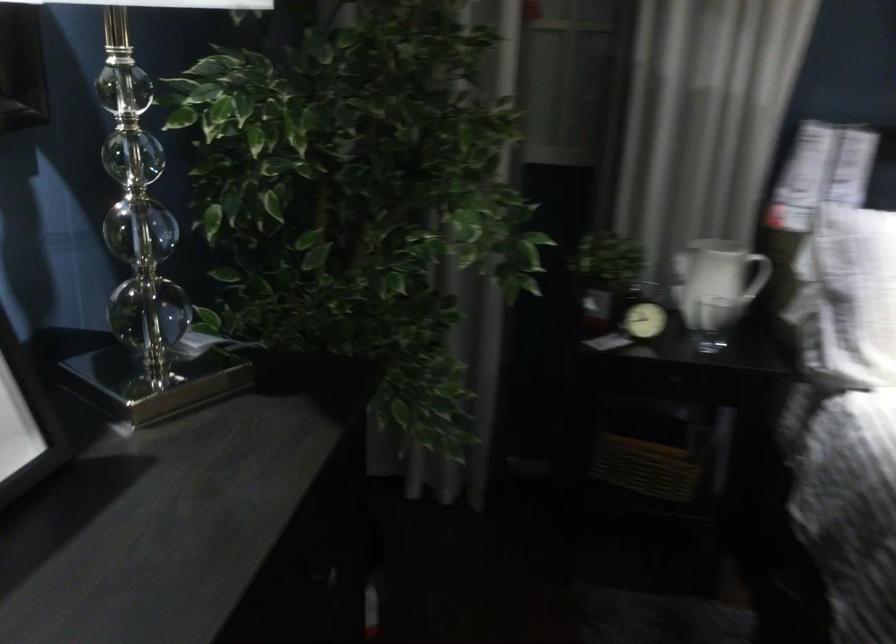
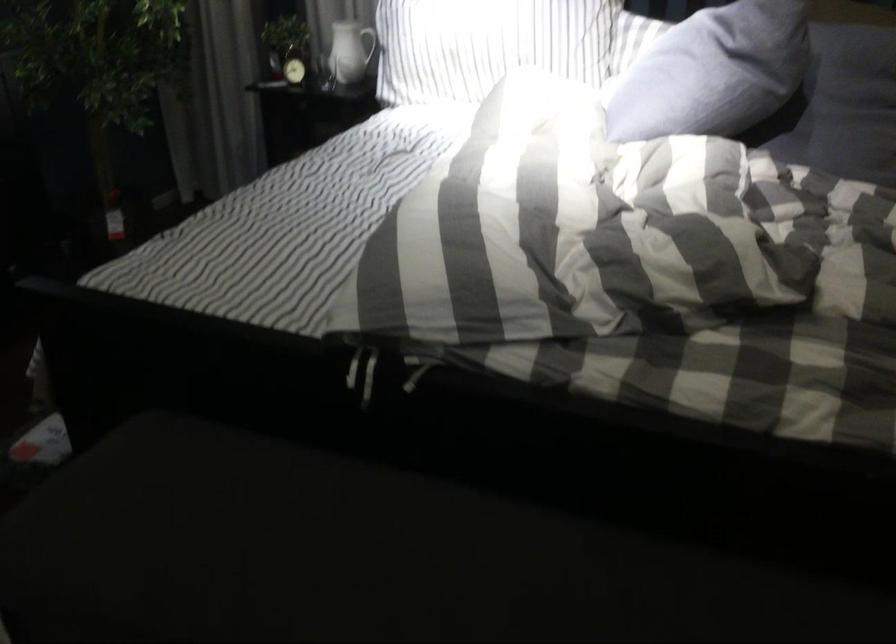
Question: I am providing you with two images of the same scene from different viewpoints. After the viewpoint changes to image2, which objects are now occluded?

Choices:
 (A) small alarm clock
 (B) pitcher handle
 (C) Toblerone chocolate box
 (D) wicker basket

Answer: (D)